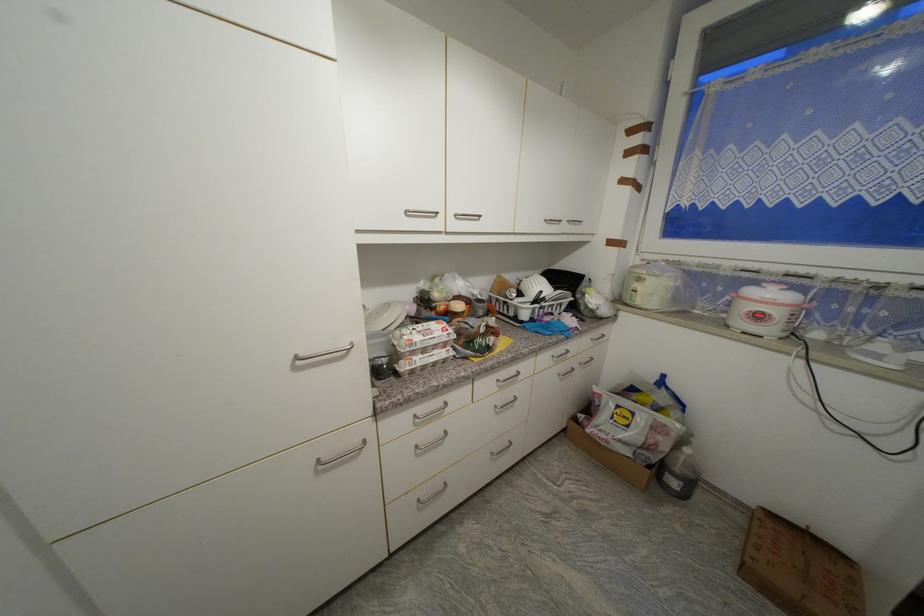
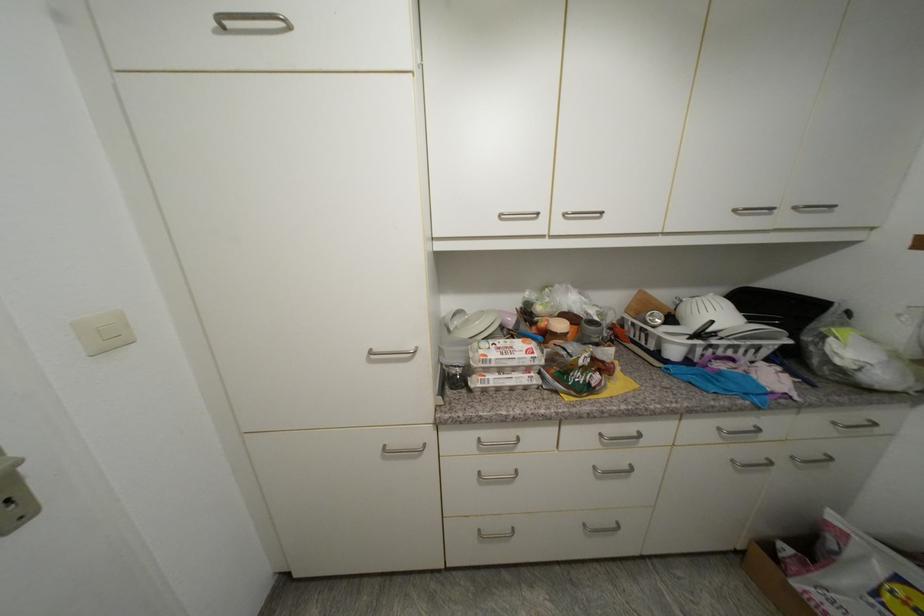
The point at (505, 278) is marked in the first image. Where is the corresponding point in the second image?

(647, 294)